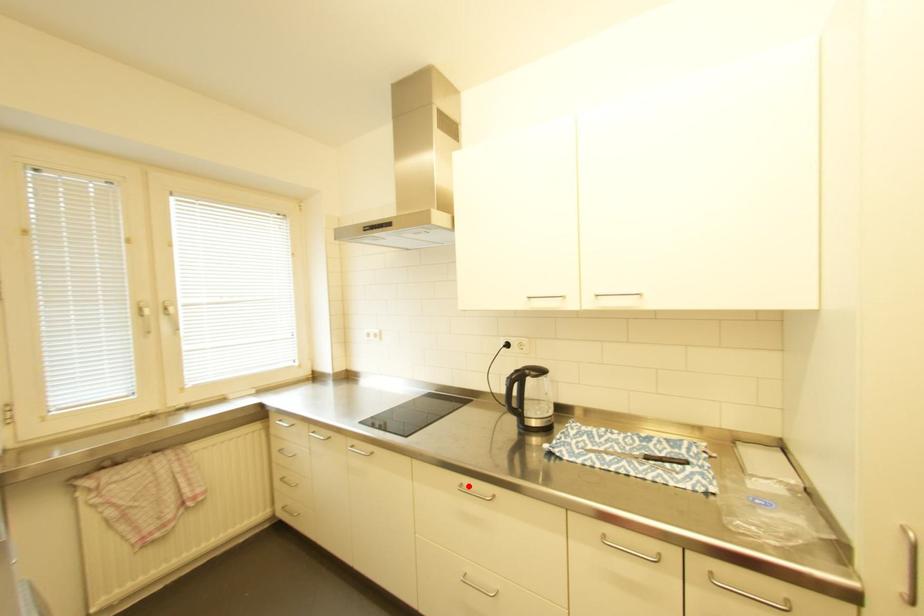
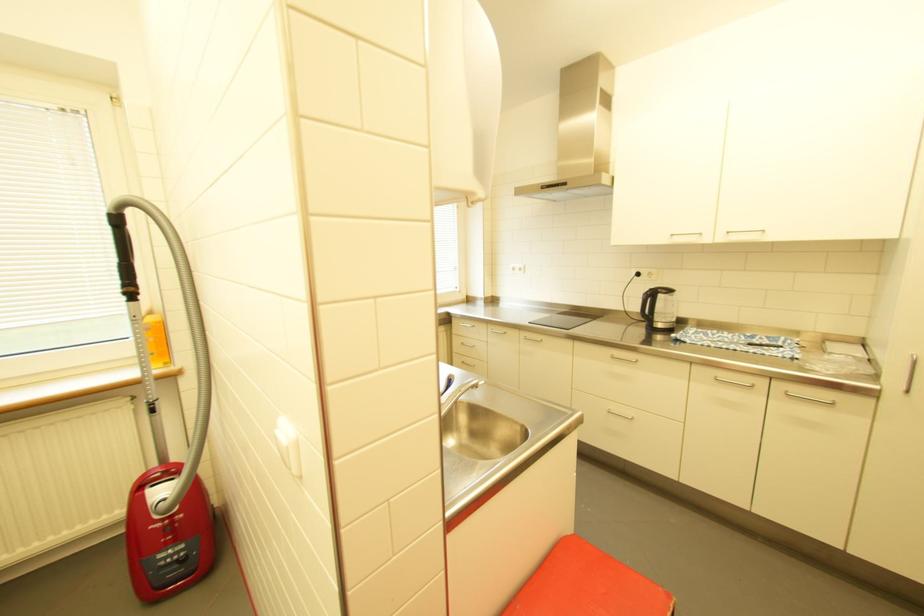
In the second image, find the point that corresponds to the highlighted location in the first image.

(621, 355)